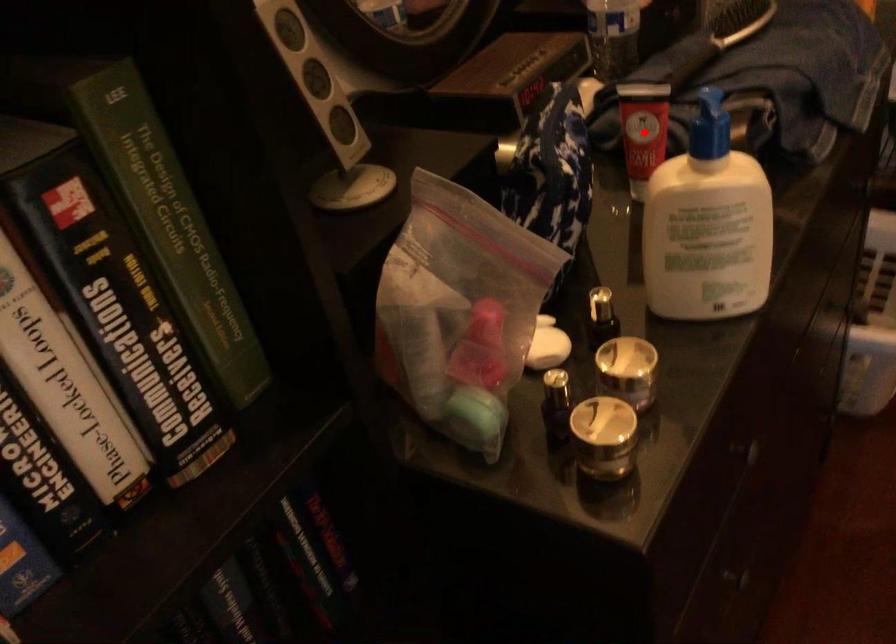
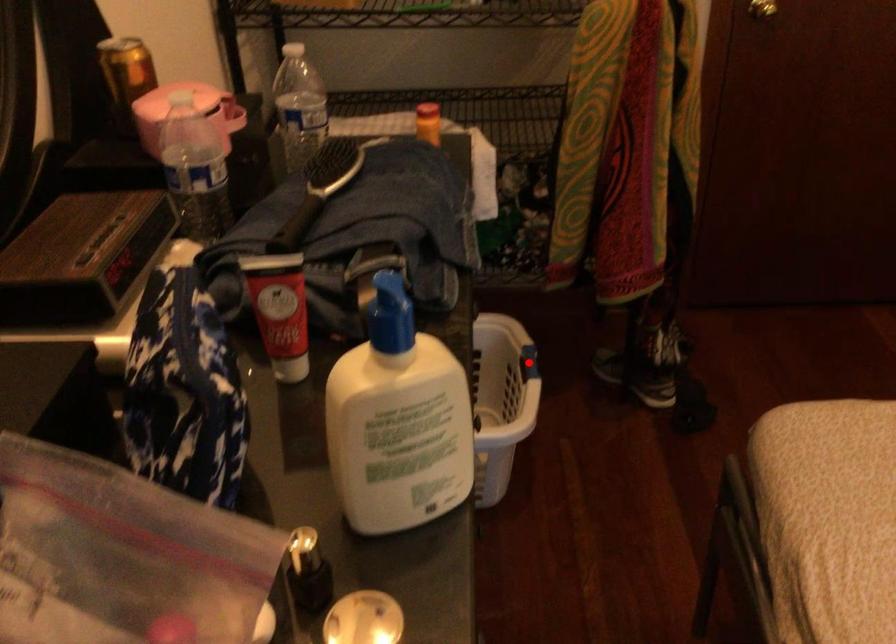
I am providing you with two images of the same scene from different viewpoints. A red point is marked on the first image and another point is marked on the second image. Do the highlighted points in image1 and image2 indicate the same real-world spot?

No